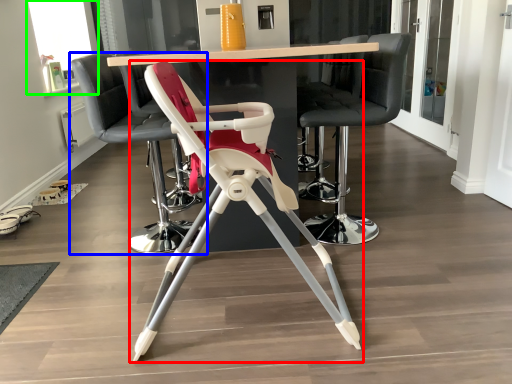
Question: Considering the real-world distances, which object is farthest from chair (highlighted by a red box)? chair (highlighted by a blue box) or window screen (highlighted by a green box)?

Choices:
 (A) chair
 (B) window screen

Answer: (B)